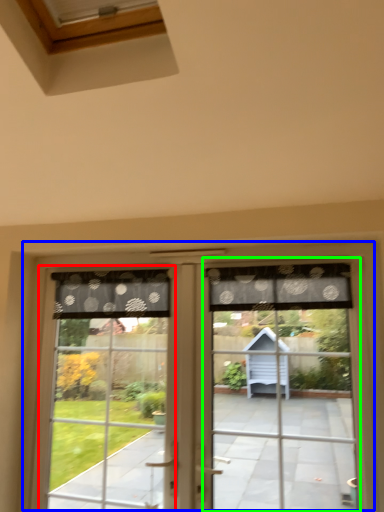
Question: Which object is the closest to the bay window (highlighted by a red box)? Choose among these: window (highlighted by a blue box) or screen door (highlighted by a green box).

Choices:
 (A) window
 (B) screen door

Answer: (A)